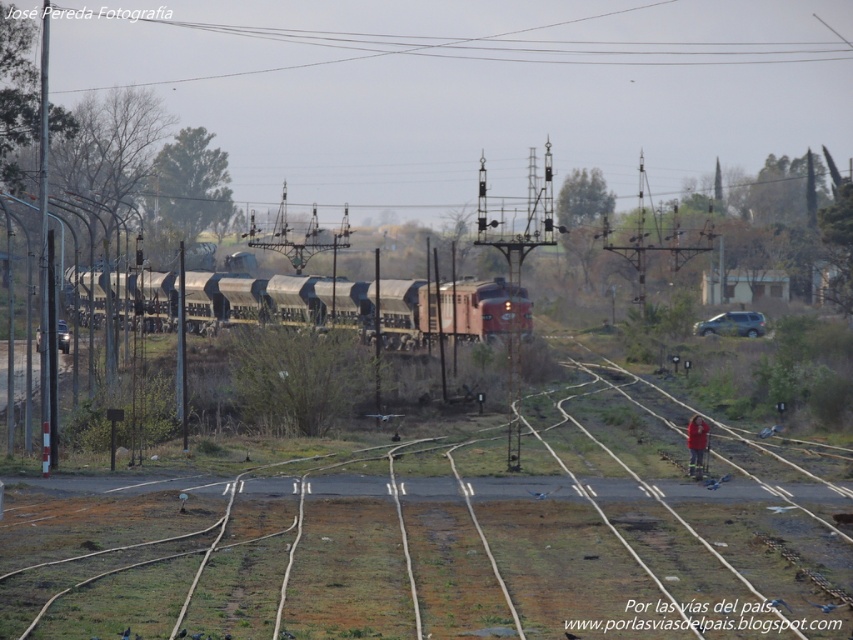
You are a pedestrian standing near the tracks and see the matte black train at center approaching. You need to quickly move to the red fabric jacket at lower right to take shelter. Given that the train is moving at 15 km per hour, will you have enough time to reach the jacket before the train arrives?

The distance between the matte black train at center and the red fabric jacket at lower right is 31.43 meters. The train is moving at 15 km per hour, which converts to approximately 4.17 meters per second. To cover 31.43 meters, the train would take about 7.53 seconds. A pedestrian can cover 31.43 meters in roughly 31.43 divided by 1.4 meters per second walking speed, which is around 22.45 seconds. Therefore, yes, there is sufficient time to reach the red fabric jacket at lower right before the train passes

You are a maintenance worker standing on the brown wooden track at center. You need to inspect the matte black train at center. Can you walk directly towards it without stepping off the track?

The brown wooden track at center is closer to the viewer than the matte black train at center, so you can walk directly towards the matte black train at center along the track.

You are a maintenance worker checking the railway. You see the brown wooden track at center and the red fabric jacket at lower right. Which object is higher in elevation?

The brown wooden track at center is taller than the red fabric jacket at lower right.